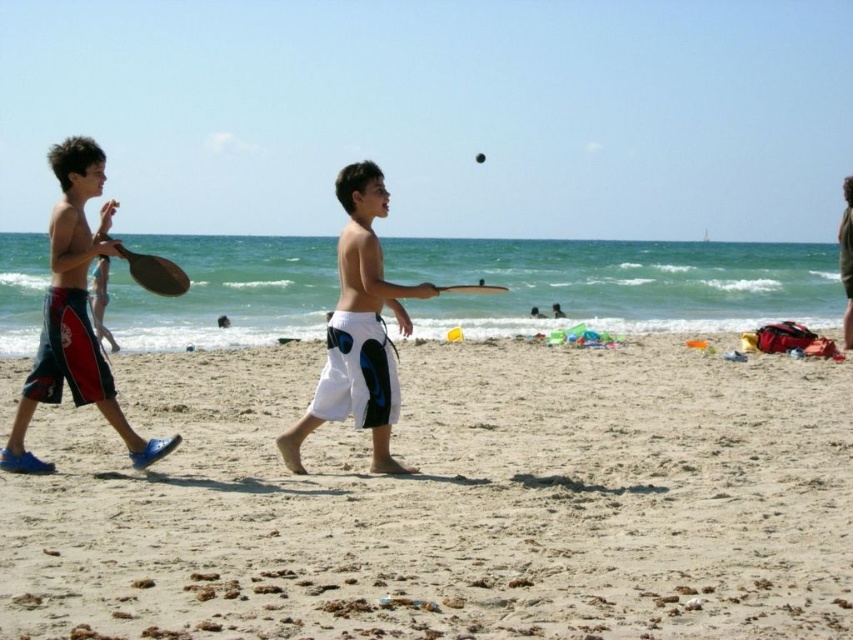
You are a drone operator trying to capture the best aerial shot of the beach scene. You need to ensure the camera focuses on the smooth sand at lower center. Given the coordinates provided, can you confirm if the point marked at (450, 502) is indeed the location of the smooth sand at lower center?

Yes, the point marked at (450, 502) corresponds to the smooth sand at lower center as described.